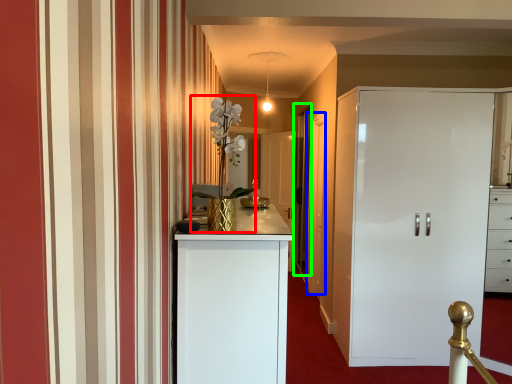
Question: Which object is positioned closest to orchid (highlighted by a red box)? Select from door (highlighted by a blue box) and glass door (highlighted by a green box).

Choices:
 (A) door
 (B) glass door

Answer: (A)